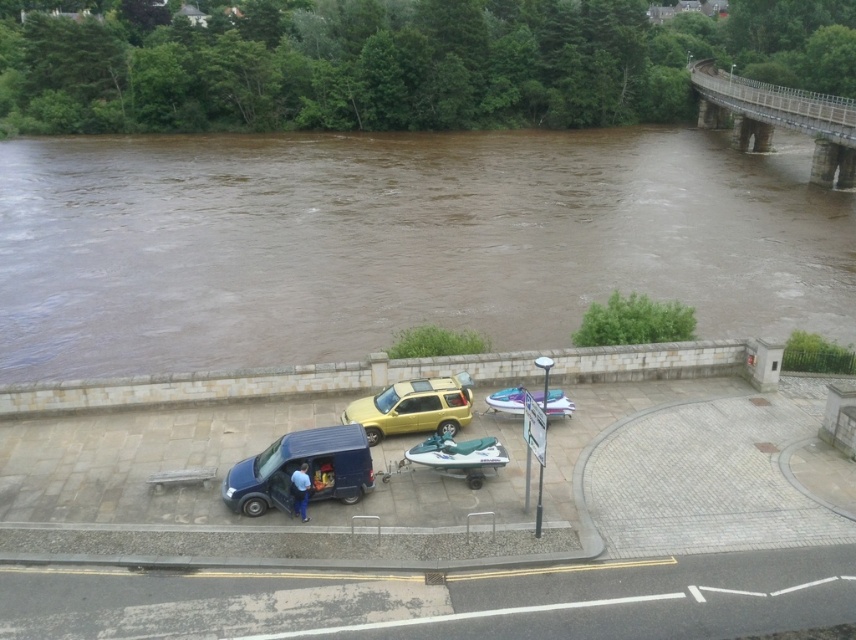
Question: Is matte black van at lower left bigger than yellow matte suv at center?

Choices:
 (A) no
 (B) yes

Answer: (A)

Question: Is brown muddy water at center further to camera compared to shiny purple boat at center?

Choices:
 (A) no
 (B) yes

Answer: (B)

Question: Considering the real-world distances, which object is closest to the brown muddy water at center?

Choices:
 (A) matte black van at lower left
 (B) yellow matte suv at center

Answer: (B)

Question: Which of these objects is positioned farthest from the shiny purple boat at center?

Choices:
 (A) yellow matte suv at center
 (B) matte black van at lower left
 (C) brown muddy water at center

Answer: (C)

Question: Considering the real-world distances, which object is farthest from the white glossy jet ski at center?

Choices:
 (A) concrete gray bridge at upper right
 (B) brown muddy water at center
 (C) matte black van at lower left

Answer: (A)

Question: Is the position of yellow matte suv at center more distant than that of white glossy jet ski at center?

Choices:
 (A) yes
 (B) no

Answer: (A)